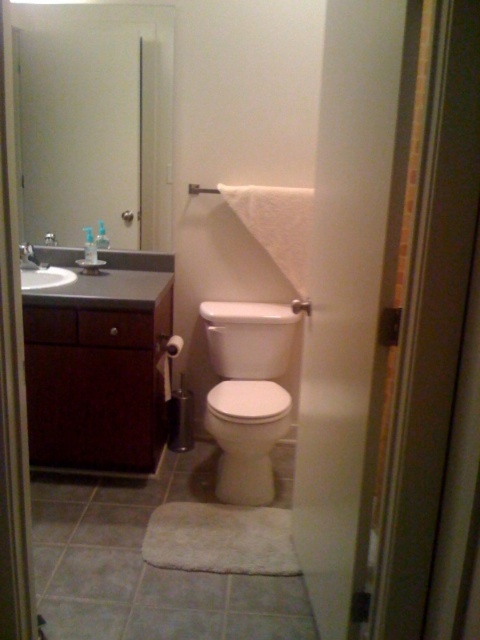
You are a plumber trying to access the pipes behind the white glossy sink at upper left. You need to determine if you can reach them without moving the matte white shower at center. Based on the scene description, can you access the pipes behind the sink?

The matte white shower at center is behind the white glossy sink at upper left, so the shower is blocking access to the pipes behind the sink. Therefore, you cannot access the pipes without moving the shower.

Based on the photo, you are planning to replace the white glossy toilet at center and the white glossy sink at upper left with new ones. The new toilet requires a space of 1.2 meters in width and the sink requires 0.8 meters. Based on their current sizes, do you think the existing spaces allocated for both fixtures are sufficient?

The white glossy toilet at center is larger than the white glossy sink at upper left. Since the toilet requires 1.2 meters and the sink needs 0.8 meters, and the toilet is bigger, it is likely that the existing space for the toilet can accommodate the new size. However, the sink, being smaller, might have less space, so it depends on the exact dimensions of the current sink area. Without specific measurements, we can only infer based on relative sizes.